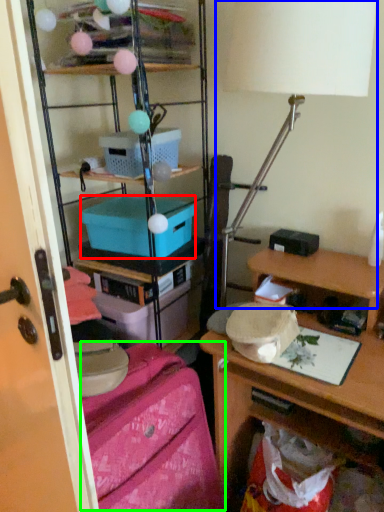
Question: Which object is the farthest from box (highlighted by a red box)? Choose among these: table lamp (highlighted by a blue box) or twin (highlighted by a green box).

Choices:
 (A) table lamp
 (B) twin

Answer: (B)